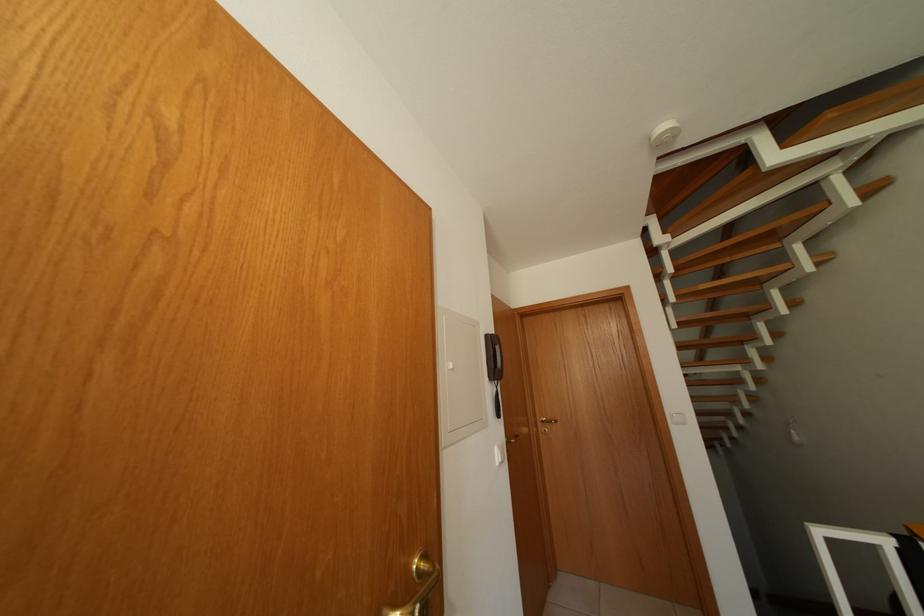
At what (x,y) coordinates should I click in order to perform the action: click on black phone handset. Please return your answer as a coordinate pair (x, y). This screenshot has height=616, width=924. Looking at the image, I should click on [493, 357].